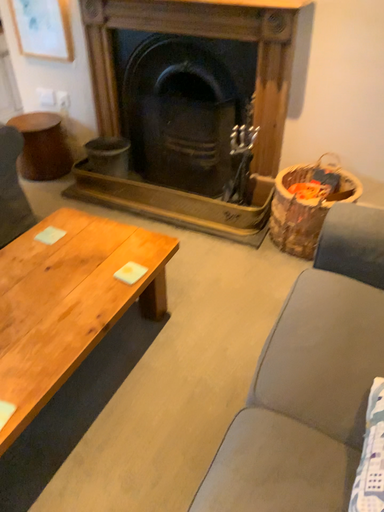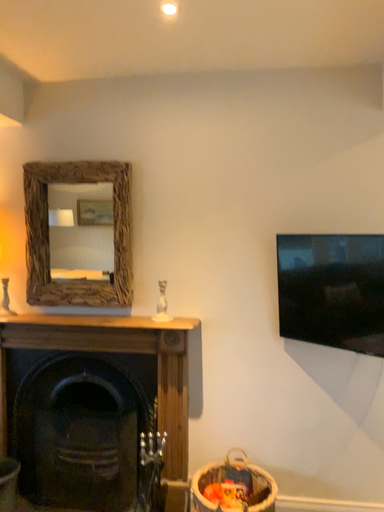
Question: How did the camera likely rotate when shooting the video?

Choices:
 (A) rotated right
 (B) rotated left

Answer: (A)